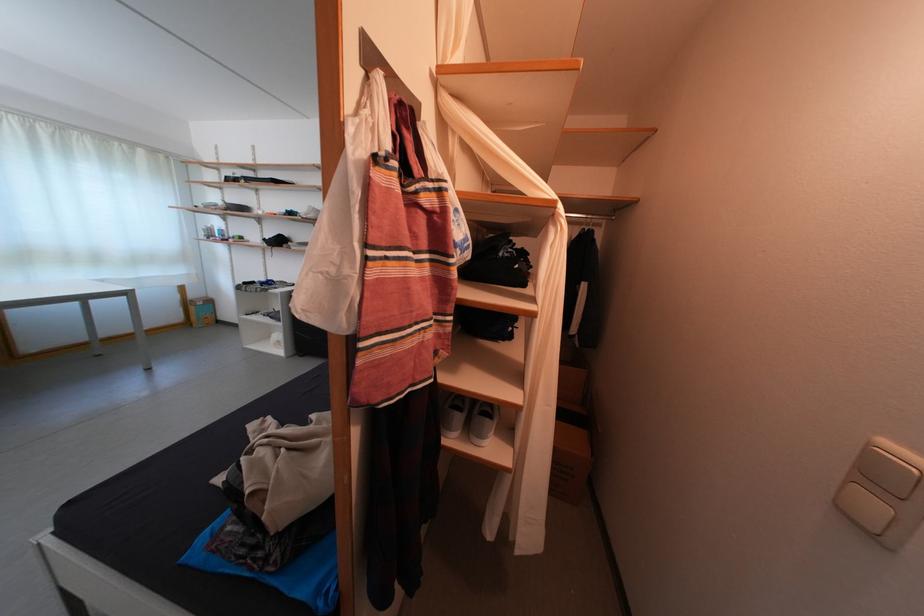
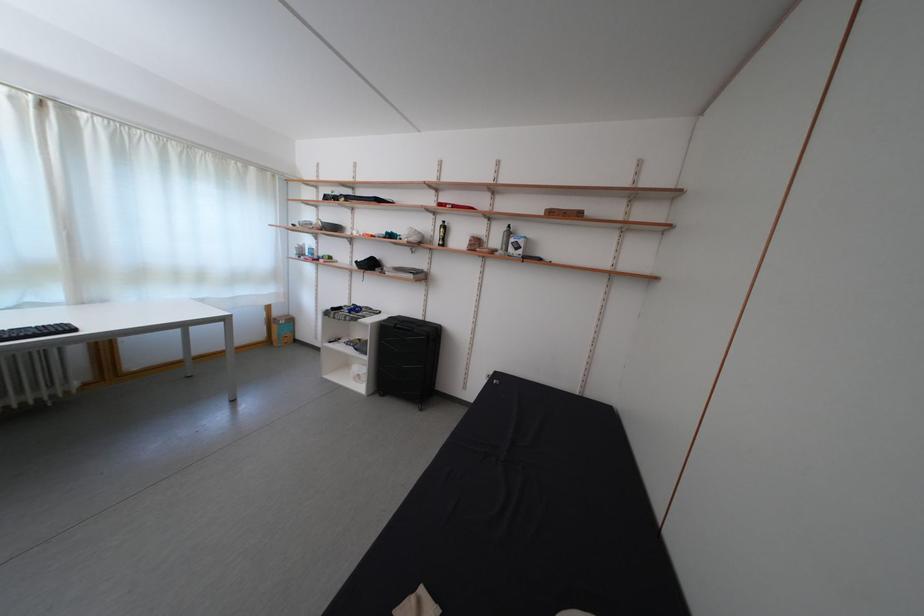
Find the pixel in the second image that matches point 201,302 in the first image.

(285, 320)